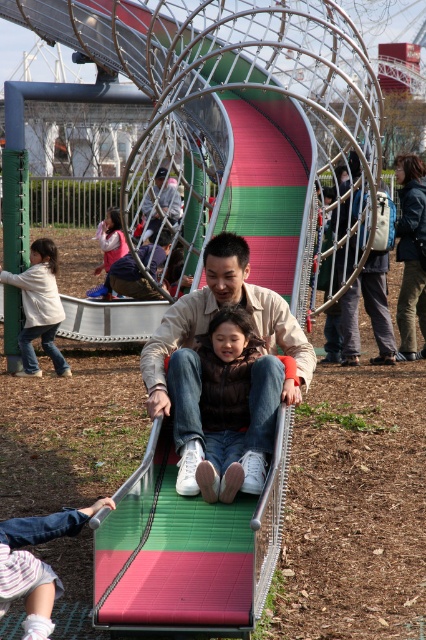
Question: Among these points, which one is nearest to the camera?

Choices:
 (A) (209, 278)
 (B) (120, 237)

Answer: (A)

Question: Which point is farther to the camera?

Choices:
 (A) white cotton shirt at left
 (B) matte blue jeans at center
 (C) striped fabric pants at lower left
 (D) matte pink jacket at lower left

Answer: (D)

Question: Can you confirm if matte beige shirt at center is positioned to the right of matte blue jeans at center?

Choices:
 (A) no
 (B) yes

Answer: (B)

Question: Which of the following is the closest to the observer?

Choices:
 (A) striped fabric pants at lower left
 (B) matte beige shirt at center

Answer: (A)

Question: Does matte beige shirt at center appear over matte silver slide at center?

Choices:
 (A) yes
 (B) no

Answer: (B)

Question: Considering the relative positions of striped fabric pants at lower left and white cotton shirt at left in the image provided, where is striped fabric pants at lower left located with respect to white cotton shirt at left?

Choices:
 (A) left
 (B) right

Answer: (B)